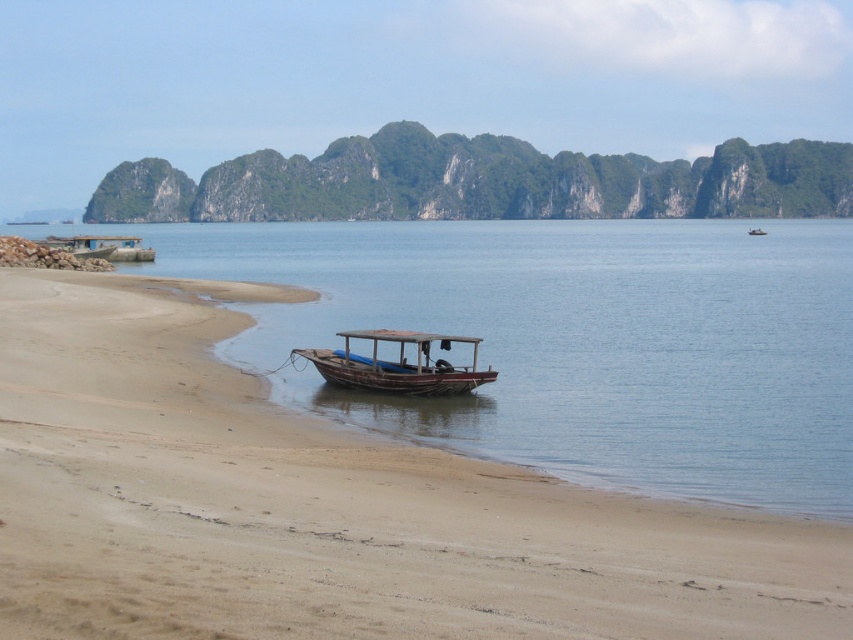
You are a photographer planning to capture a wide shot of the brown sandy beach at center and the rusty wooden boat at center. Given their sizes, which one should you focus on to ensure both are clearly visible in the frame?

The brown sandy beach at center has a larger size compared to the rusty wooden boat at center, so focusing on the larger brown sandy beach at center will ensure both are clearly visible in the frame.

You are standing on the brown sandy beach at center and want to reach the rusty wooden boat at center. Which direction should you walk to get there?

You should walk to the right because the brown sandy beach at center is to the left of the rusty wooden boat at center, so moving right will take you towards the boat.